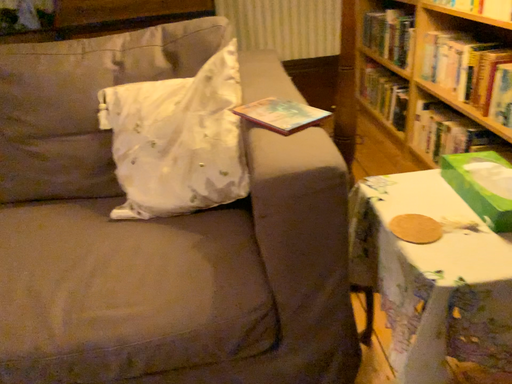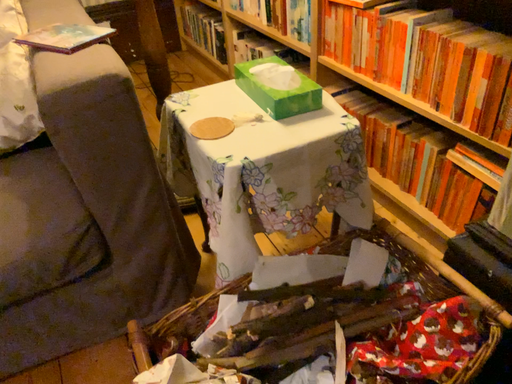
Question: How did the camera likely rotate when shooting the video?

Choices:
 (A) rotated right
 (B) rotated left

Answer: (A)